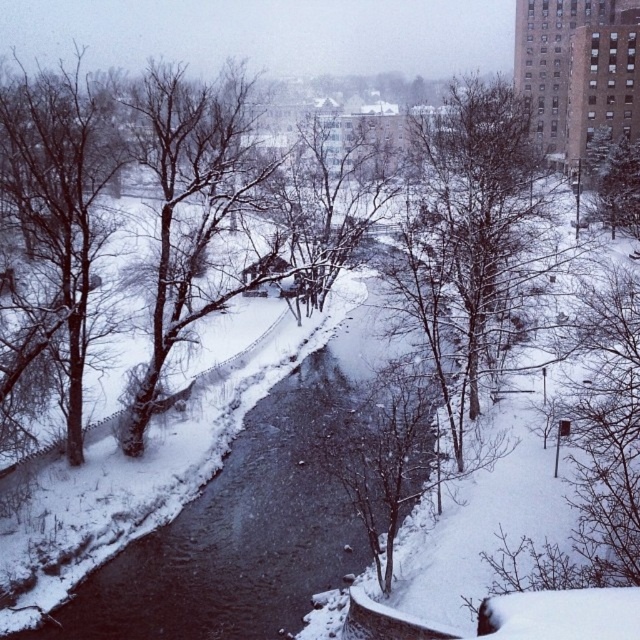
Which is more to the left, bare branches at left or bare branches at center?

From the viewer's perspective, bare branches at left appears more on the left side.

Does bare branches at left have a larger size compared to bare branches at center?

No.

I want to click on bare branches at left, so click(54, 236).

Does bare branches at left have a greater width compared to snow-covered tree at center?

Incorrect, bare branches at left's width does not surpass snow-covered tree at center's.

Does bare branches at left have a lesser width compared to snow-covered tree at center?

Indeed, bare branches at left has a lesser width compared to snow-covered tree at center.

The width and height of the screenshot is (640, 640). What are the coordinates of `bare branches at left` in the screenshot? It's located at (54, 236).

Which is below, black ice river at center or bare branches at center?

black ice river at center is below.

Which is more to the right, black ice river at center or bare branches at center?

black ice river at center

The width and height of the screenshot is (640, 640). Describe the element at coordinates (244, 524) in the screenshot. I see `black ice river at center` at that location.

Identify the location of black ice river at center. The height and width of the screenshot is (640, 640). (244, 524).